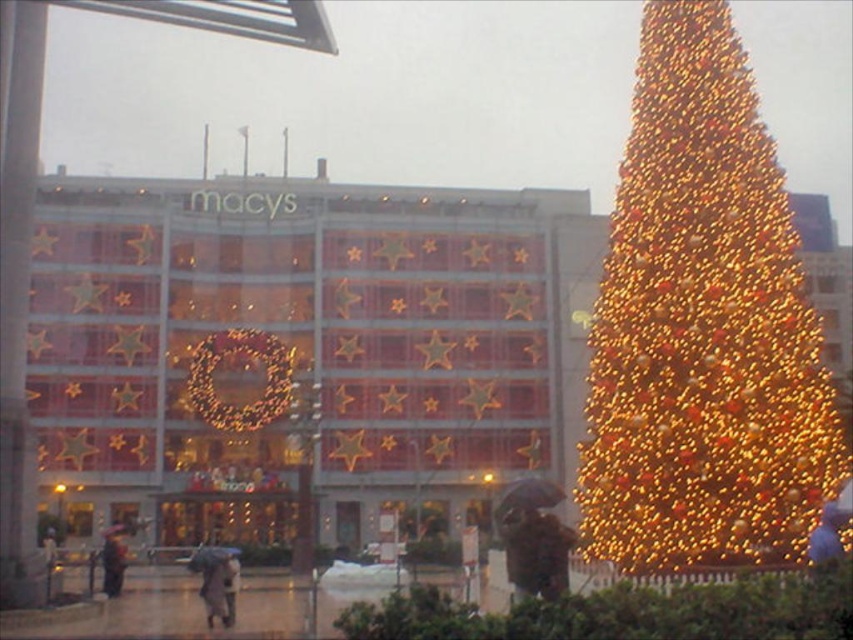
You are a pedestrian trying to stay dry while walking past the Macy store. You see the blue fabric umbrella at lower right and the dark gray coat at lower left. Which item is above the other?

The blue fabric umbrella at lower right is positioned over dark gray coat at lower left, so the umbrella is above the coat.

You are standing in front of the Macy store and want to take a photo of the illuminated gold christmas tree at right. If your camera has a maximum focus range of 50 meters, will it be able to capture the tree clearly?

The illuminated gold christmas tree at right is 52.64 meters from camera, which is beyond the camera maximum focus range of 50 meters. So the camera cannot capture the tree clearly.

You are standing in front of the Macy store during a rainy day and want to reach a specific point marked at coordinates point (810, 506). Given that you can walk 3 feet per second, how many seconds will it take you to reach that point?

The distance between you and point (810, 506) is 175.00 feet. At a walking speed of 3 feet per second, it will take you 175 divided by 3 equals approximately 58.33 seconds to reach the point.